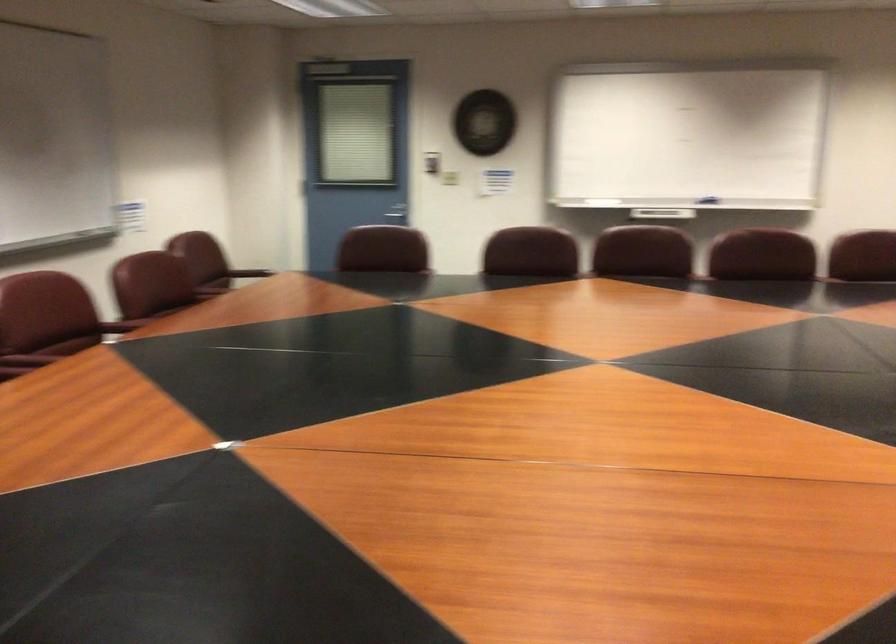
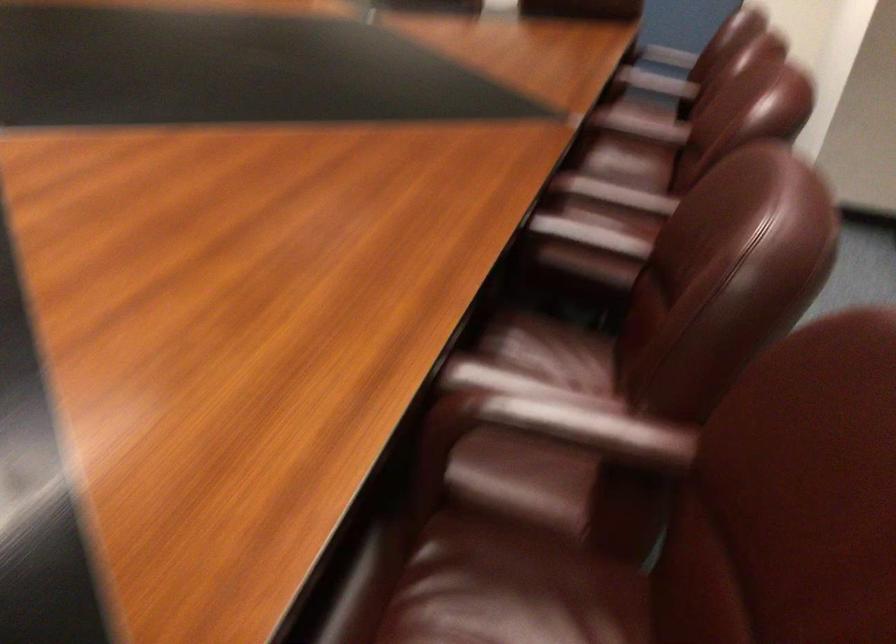
The point at (x=160, y=310) is marked in the first image. Where is the corresponding point in the second image?

(590, 247)